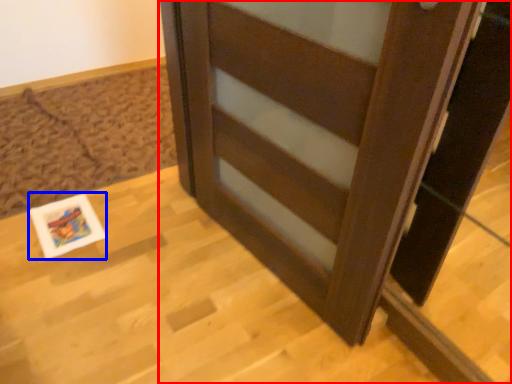
Question: Which of the following is the farthest to the observer, furniture (highlighted by a red box) or postcard (highlighted by a blue box)?

Choices:
 (A) furniture
 (B) postcard

Answer: (B)